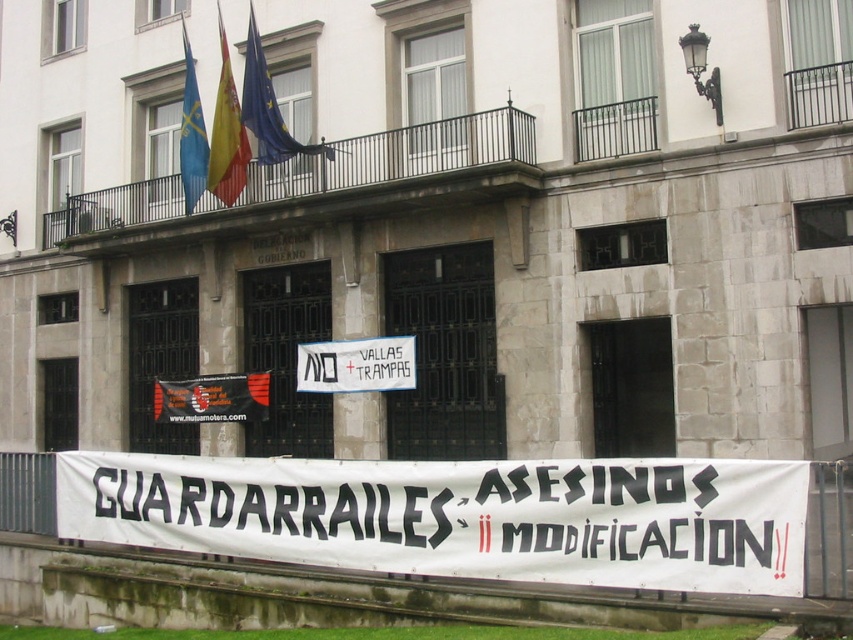
How much distance is there between white paper sign at center and yellow fabric flag at upper center?

The distance of white paper sign at center from yellow fabric flag at upper center is 11.49 feet.

Measure the distance from white paper sign at center to yellow fabric flag at upper center.

white paper sign at center and yellow fabric flag at upper center are 3.50 meters apart from each other.

Locate an element on the screen. The width and height of the screenshot is (853, 640). white paper sign at center is located at coordinates (357, 364).

Does white paper banner at lower center lie behind white paper sign at center?

That is False.

This screenshot has width=853, height=640. What do you see at coordinates (459, 516) in the screenshot? I see `white paper banner at lower center` at bounding box center [459, 516].

Who is more forward, (540, 508) or (325, 362)?

Point (540, 508) is more forward.

The width and height of the screenshot is (853, 640). I want to click on white paper banner at lower center, so click(459, 516).

Can you confirm if black fabric banner at lower center is smaller than blue fabric flag at upper center?

Actually, black fabric banner at lower center might be larger than blue fabric flag at upper center.

Does black fabric banner at lower center have a larger size compared to blue fabric flag at upper center?

Yes, black fabric banner at lower center is bigger than blue fabric flag at upper center.

Does point (254, 388) lie behind point (283, 154)?

That is True.

Where is `black fabric banner at lower center`? black fabric banner at lower center is located at coordinates (212, 397).